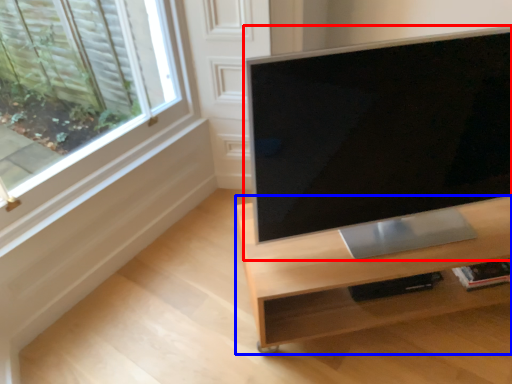
Question: Among these objects, which one is farthest to the camera, computer monitor (highlighted by a red box) or desk (highlighted by a blue box)?

Choices:
 (A) computer monitor
 (B) desk

Answer: (B)